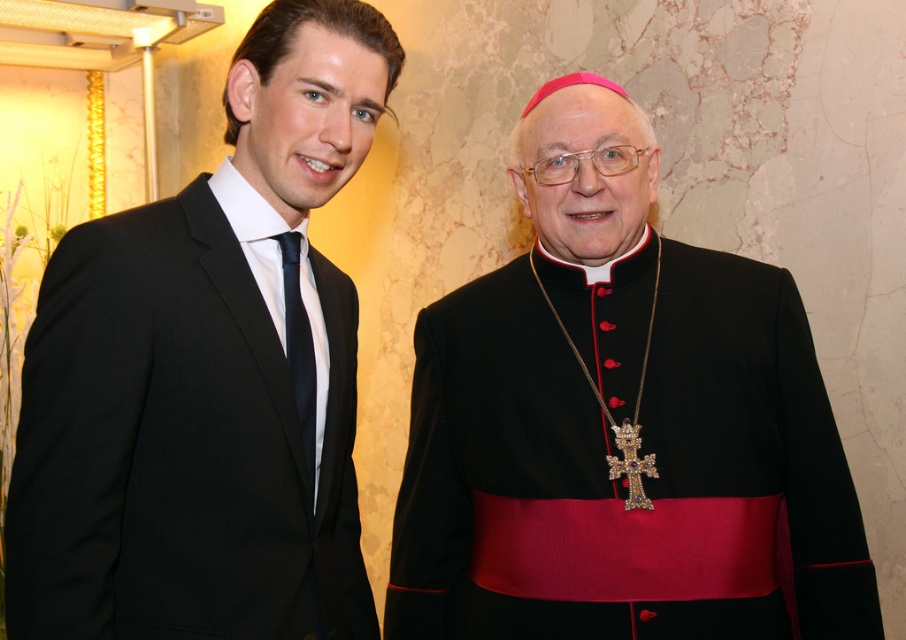
Question: Among these points, which one is nearest to the camera?

Choices:
 (A) click(615, 397)
 (B) click(307, 419)
 (C) click(363, 99)

Answer: (C)

Question: Can you confirm if black velvet cassock at center is smaller than matte black tie at left?

Choices:
 (A) no
 (B) yes

Answer: (A)

Question: Is black satin suit at left to the right of matte black tie at left from the viewer's perspective?

Choices:
 (A) yes
 (B) no

Answer: (B)

Question: Which object is positioned closest to the matte black tie at left?

Choices:
 (A) black satin suit at left
 (B) black velvet cassock at center

Answer: (A)

Question: Is black velvet cassock at center positioned behind black satin suit at left?

Choices:
 (A) yes
 (B) no

Answer: (A)

Question: Among these points, which one is farthest from the camera?

Choices:
 (A) (299, 390)
 (B) (65, 525)

Answer: (A)